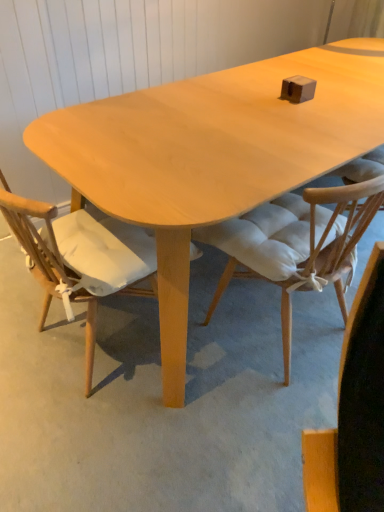
At what (x,y) coordinates should I click in order to perform the action: click on free region under light wood chair at center, which is the 2th chair in right-to-left order (from a real-world perspective). Please return your answer as a coordinate pair (x, y). Looking at the image, I should click on (104, 337).